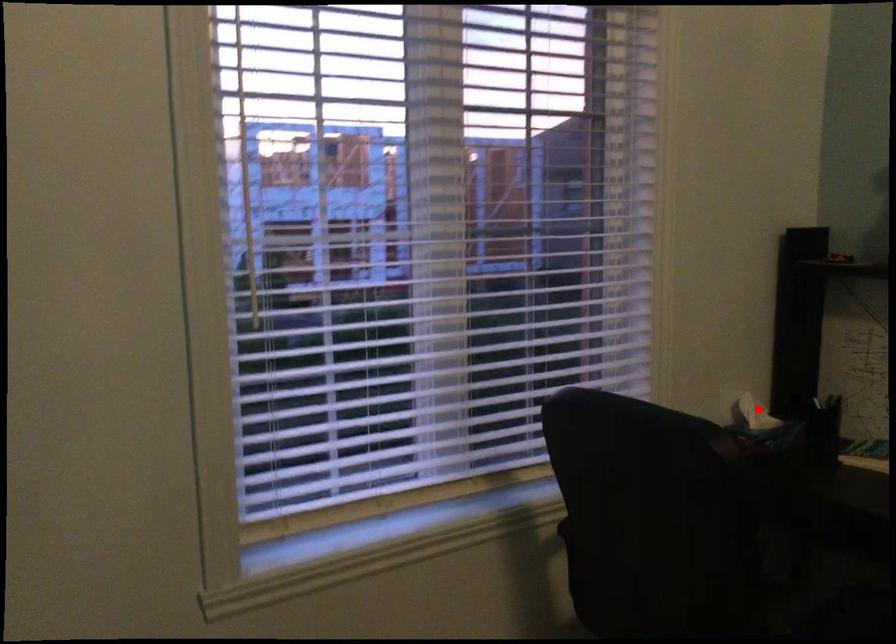
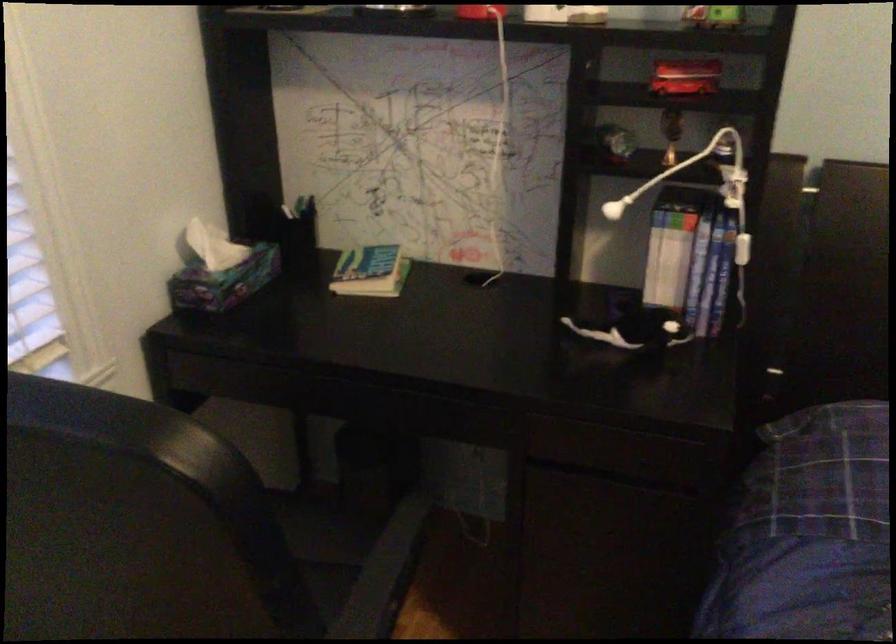
Question: I am providing you with two images of the same scene from different viewpoints. A red point is shown in image1. For the corresponding object point in image2, is it positioned nearer or farther from the camera?

Choices:
 (A) Nearer
 (B) Farther

Answer: (A)